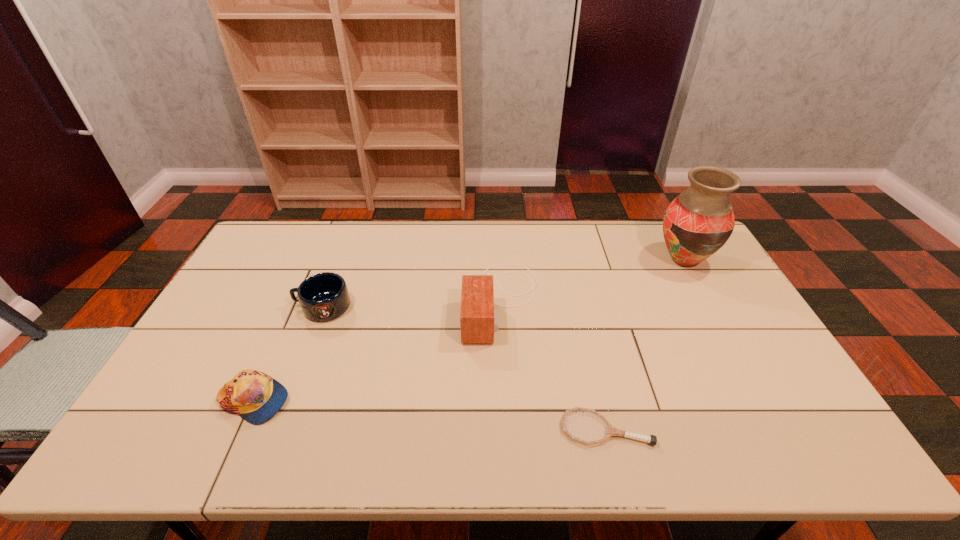
Locate an element on the screen. This screenshot has height=540, width=960. free point located on the front-facing side of the radio receiver is located at coordinates (401, 301).

Where is `vacant region located on the front-facing side of the radio receiver`? vacant region located on the front-facing side of the radio receiver is located at coordinates (418, 301).

Where is `vacant space located 0.060m with the handle on the side of the mug`? Image resolution: width=960 pixels, height=540 pixels. vacant space located 0.060m with the handle on the side of the mug is located at coordinates (276, 307).

Locate an element on the screen. The width and height of the screenshot is (960, 540). vacant space located 0.110m with the handle on the side of the mug is located at coordinates (259, 307).

Find the location of `free space located with the handle on the side of the mug`. free space located with the handle on the side of the mug is located at coordinates (220, 307).

The image size is (960, 540). What are the coordinates of `vacant space located on the bill of the cap` in the screenshot? It's located at (348, 401).

The image size is (960, 540). Identify the location of vacant space situated on the right of the shortest object. (760, 428).

Locate an element on the screen. object that is at the far edge is located at coordinates (697, 223).

Where is `cap that is positioned at the near edge`? Image resolution: width=960 pixels, height=540 pixels. cap that is positioned at the near edge is located at coordinates (256, 397).

Where is `tennis racket located in the near edge section of the desktop`? This screenshot has width=960, height=540. tennis racket located in the near edge section of the desktop is located at coordinates (611, 431).